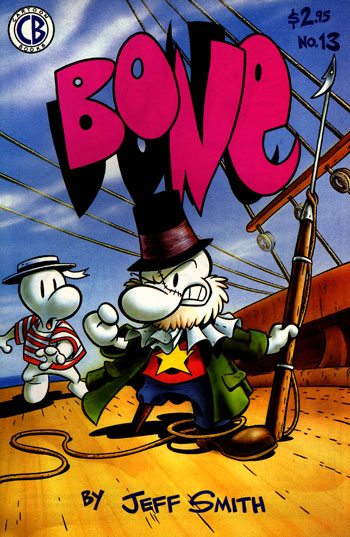
Where is `cord`? Image resolution: width=350 pixels, height=537 pixels. cord is located at coordinates (342, 101), (337, 132), (309, 146), (329, 248), (276, 260), (251, 263), (249, 277), (246, 289).